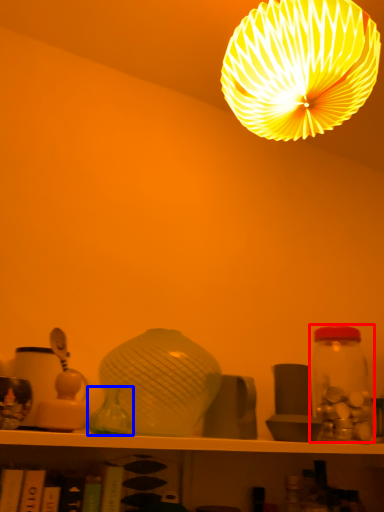
Question: Which object is closer to the camera taking this photo, glass jar (highlighted by a red box) or glass vase (highlighted by a blue box)?

Choices:
 (A) glass jar
 (B) glass vase

Answer: (B)